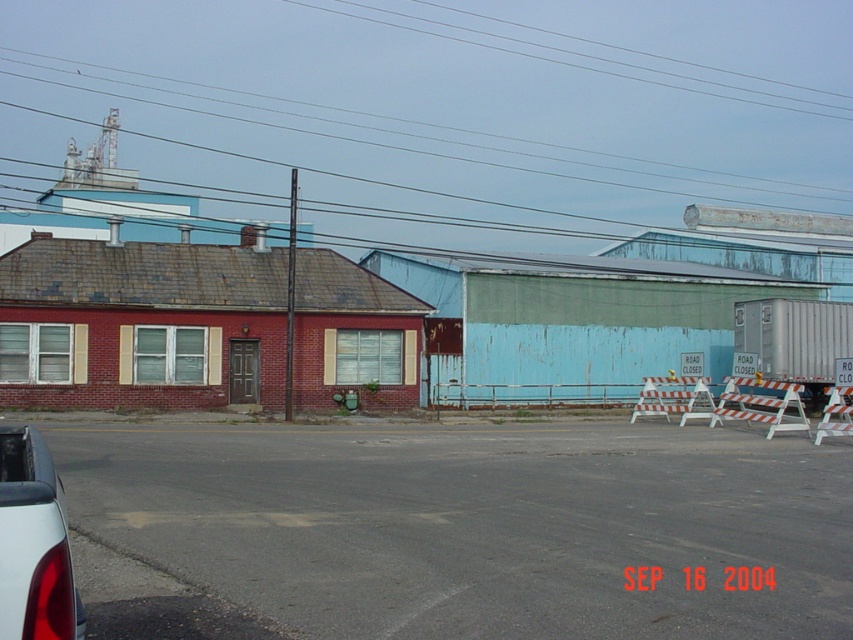
You are a delivery driver who needs to park your truck in the parking lot behind the red brick building. However, there is a matte black car at lower left and a clear wire at upper center in the way. Which object is narrower so you can maneuver around it?

The matte black car at lower left is thinner than the clear wire at upper center, so you can maneuver around the matte black car at lower left more easily.

You are a pedestrian standing on the road and see the matte black car at lower left and the clear wire at upper center. Which object is taller?

The clear wire at upper center is taller than the matte black car at lower left.

You are a delivery driver who needs to park your matte black car at lower left in a spot that is 0.8 meters away from the edge of the road. According to the coordinates provided, can your car be parked correctly?

The matte black car at lower left is positioned at point (33,544). Since the parking spot requires being 0.8 meters from the edge, the car is slightly beyond the required distance and may not fit properly.